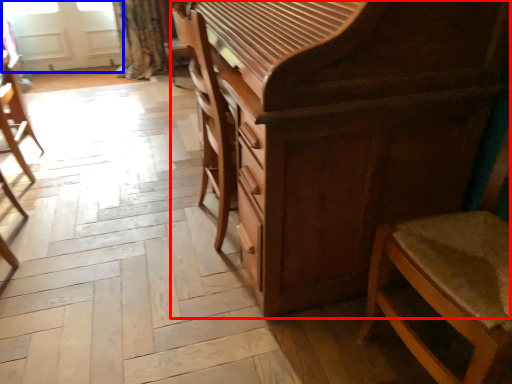
Question: Among these objects, which one is farthest to the camera, chest of drawers (highlighted by a red box) or screen door (highlighted by a blue box)?

Choices:
 (A) chest of drawers
 (B) screen door

Answer: (B)